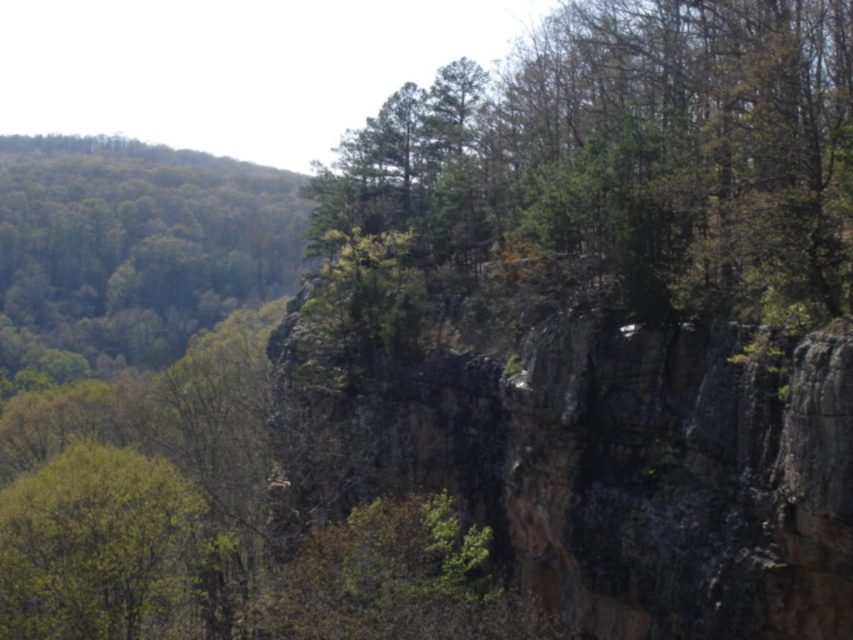
Question: Which point is closer to the camera?

Choices:
 (A) (71, 467)
 (B) (625, 300)

Answer: (B)

Question: Which point appears farthest from the camera in this image?

Choices:
 (A) (682, 156)
 (B) (71, 580)

Answer: (B)

Question: Does green leafy tree at center appear over green leafy tree at lower left?

Choices:
 (A) yes
 (B) no

Answer: (A)

Question: Can you confirm if green leafy tree at center is wider than green leafy tree at lower left?

Choices:
 (A) yes
 (B) no

Answer: (A)

Question: Does green leafy tree at center appear on the left side of green leafy tree at lower left?

Choices:
 (A) yes
 (B) no

Answer: (B)